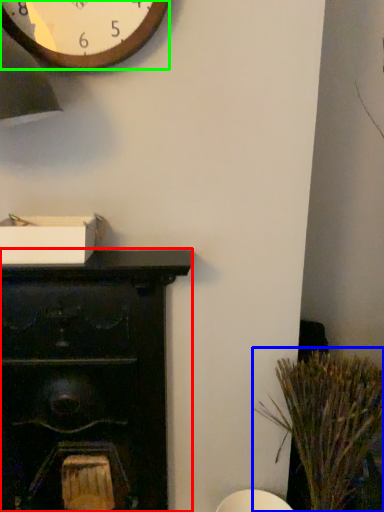
Question: Which object is the farthest from furniture (highlighted by a red box)? Choose among these: plant (highlighted by a blue box) or wall clock (highlighted by a green box).

Choices:
 (A) plant
 (B) wall clock

Answer: (B)